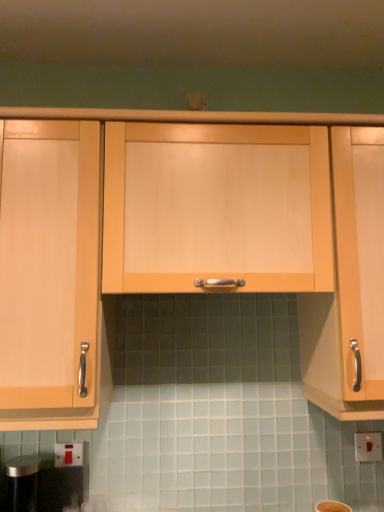
Question: Which is correct: light wood cabinet at left, the 1th cabinetry when ordered from left to right, is inside light wood cabinet handle at right, arranged as the 3th cabinetry when viewed from the left, or outside of it?

Choices:
 (A) inside
 (B) outside

Answer: (B)

Question: Would you say light wood cabinet at left, which appears as the 3th cabinetry when viewed from the right, is to the left or to the right of light wood cabinet handle at right, the 1th cabinetry in the right-to-left sequence, in the picture?

Choices:
 (A) left
 (B) right

Answer: (A)

Question: Which object is the farthest from the white plastic switch at lower right, the 2th electric outlet in the front-to-back sequence?

Choices:
 (A) matte white electric outlet at lower left, which is the 1th electric outlet in left-to-right order
 (B) light wood cabinet handle at right, the 1th cabinetry in the right-to-left sequence
 (C) light wood cabinet at center, which ranks as the second cabinetry in right-to-left order
 (D) light wood cabinet at left, which appears as the 3th cabinetry when viewed from the right
 (E) metallic cylindrical container at lower left

Answer: (D)

Question: Based on their relative distances, which object is nearer to the matte white electric outlet at lower left, the first electric outlet in the front-to-back sequence?

Choices:
 (A) metallic cylindrical container at lower left
 (B) light wood cabinet handle at right, the 1th cabinetry in the right-to-left sequence
 (C) white plastic switch at lower right, positioned as the 1th electric outlet in back-to-front order
 (D) light wood cabinet at left, which appears as the 3th cabinetry when viewed from the right
 (E) light wood cabinet at center, which ranks as the second cabinetry in right-to-left order

Answer: (A)